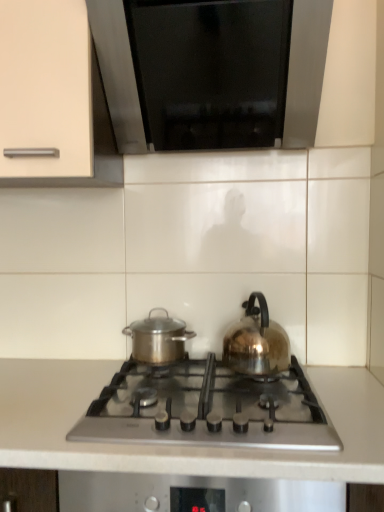
Identify the location of vacant space in front of stainless steel pot at center. (157, 376).